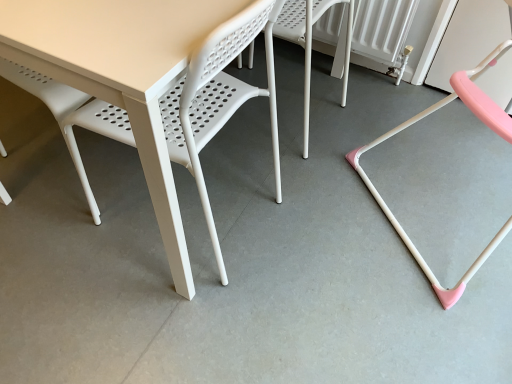
What are the coordinates of `white plastic chair at center, the 1th chair when ordered from left to right` in the screenshot? It's located at (309, 40).

In order to face white plastic chair at center, the second chair viewed from the right, should I rotate leftwards or rightwards?

Turn right by 5.564 degrees to look at white plastic chair at center, the second chair viewed from the right.

Image resolution: width=512 pixels, height=384 pixels. I want to click on pink plastic chair at right, which is counted as the second chair, starting from the left, so click(x=419, y=120).

The image size is (512, 384). What do you see at coordinates (150, 84) in the screenshot?
I see `white plastic table at center` at bounding box center [150, 84].

Identify the location of white plastic chair at center, the 1th chair when ordered from left to right. (309, 40).

How distant is white plastic chair at center, the second chair viewed from the right, from pink plastic chair at right, which is counted as the second chair, starting from the left?

white plastic chair at center, the second chair viewed from the right, is 19.30 inches from pink plastic chair at right, which is counted as the second chair, starting from the left.

Which object is thinner, white plastic chair at center, the 1th chair when ordered from left to right, or pink plastic chair at right, which is counted as the second chair, starting from the left?

Thinner between the two is white plastic chair at center, the 1th chair when ordered from left to right.

From a real-world perspective, relative to pink plastic chair at right, the first chair when ordered from right to left, is white plastic chair at center, the second chair viewed from the right, vertically above or below?

white plastic chair at center, the second chair viewed from the right, is situated lower than pink plastic chair at right, the first chair when ordered from right to left, in the real world.

From the image's perspective, is white plastic chair at center, the 1th chair when ordered from left to right, over pink plastic chair at right, the first chair when ordered from right to left?

Correct, white plastic chair at center, the 1th chair when ordered from left to right, appears higher than pink plastic chair at right, the first chair when ordered from right to left, in the image.

You are a GUI agent. You are given a task and a screenshot of the screen. Output one action in this format:
    pyautogui.click(x=<x>, y=<y>)
    Task: Click on the 1st chair behind the white plastic table at center, starting your count from the anchor
    The image size is (512, 384).
    Given the screenshot: What is the action you would take?
    pyautogui.click(x=419, y=120)

Can you confirm if pink plastic chair at right, the first chair when ordered from right to left, is positioned to the left of white plastic table at center?

In fact, pink plastic chair at right, the first chair when ordered from right to left, is to the right of white plastic table at center.

Which point is more forward, (368, 180) or (112, 35)?

Point (112, 35)

Is pink plastic chair at right, the first chair when ordered from right to left, inside the boundaries of white plastic table at center, or outside?

pink plastic chair at right, the first chair when ordered from right to left, is not enclosed by white plastic table at center.

At what (x,y) coordinates should I click in order to perform the action: click on table on the left of the pink plastic chair at right, the first chair when ordered from right to left. Please return your answer as a coordinate pair (x, y). The width and height of the screenshot is (512, 384). Looking at the image, I should click on (150, 84).

Is white plastic table at center inside or outside of pink plastic chair at right, which is counted as the second chair, starting from the left?

white plastic table at center is not inside pink plastic chair at right, which is counted as the second chair, starting from the left, it's outside.

What's the angular difference between white plastic table at center and pink plastic chair at right, which is counted as the second chair, starting from the left,'s facing directions?

48.1 degrees separate the facing orientations of white plastic table at center and pink plastic chair at right, which is counted as the second chair, starting from the left.

How far apart are white plastic table at center and pink plastic chair at right, the first chair when ordered from right to left?

white plastic table at center and pink plastic chair at right, the first chair when ordered from right to left, are 32.81 inches apart from each other.

From the image's perspective, between white plastic table at center and white plastic chair at center, the second chair viewed from the right, who is located below?

white plastic table at center.

Is white plastic table at center thinner than white plastic chair at center, the 1th chair when ordered from left to right?

In fact, white plastic table at center might be wider than white plastic chair at center, the 1th chair when ordered from left to right.

Can you see white plastic table at center touching white plastic chair at center, the second chair viewed from the right?

white plastic table at center and white plastic chair at center, the second chair viewed from the right, are not in contact.

Based on the photo, is white plastic table at center aimed at white plastic chair at center, the second chair viewed from the right?

No.

Can you confirm if white plastic chair at center, the second chair viewed from the right, is thinner than white plastic table at center?

Yes.

Does white plastic chair at center, the 1th chair when ordered from left to right, lie behind white plastic table at center?

Yes, white plastic chair at center, the 1th chair when ordered from left to right, is further from the viewer.

Does point (307, 23) come closer to viewer compared to point (225, 35)?

That is False.

Is there a large distance between white plastic chair at center, the 1th chair when ordered from left to right, and white plastic table at center?

They are positioned close to each other.

Is pink plastic chair at right, which is counted as the second chair, starting from the left, in front of or behind white plastic chair at center, the 1th chair when ordered from left to right, in the image?

Clearly, pink plastic chair at right, which is counted as the second chair, starting from the left, is in front of white plastic chair at center, the 1th chair when ordered from left to right.

Is pink plastic chair at right, which is counted as the second chair, starting from the left, thinner than white plastic chair at center, the 1th chair when ordered from left to right?

No.

Does pink plastic chair at right, the first chair when ordered from right to left, appear on the left side of white plastic chair at center, the second chair viewed from the right?

No.

Which point is more forward, (469, 268) or (309, 109)?

The point (469, 268) is more forward.

Where is `chair above the white plastic chair at center, the 1th chair when ordered from left to right (from a real-world perspective)`? chair above the white plastic chair at center, the 1th chair when ordered from left to right (from a real-world perspective) is located at coordinates (419, 120).

This screenshot has width=512, height=384. In order to click on chair that is the 1st object located above the white plastic table at center (from the image's perspective) in this screenshot , I will do `click(419, 120)`.

In the scene shown: Based on their spatial positions, is white plastic chair at center, the second chair viewed from the right, or white plastic table at center closer to pink plastic chair at right, which is counted as the second chair, starting from the left?

white plastic chair at center, the second chair viewed from the right, is positioned closer to the anchor pink plastic chair at right, which is counted as the second chair, starting from the left.

When comparing their distances from white plastic table at center, does white plastic chair at center, the 1th chair when ordered from left to right, or pink plastic chair at right, which is counted as the second chair, starting from the left, seem closer?

white plastic chair at center, the 1th chair when ordered from left to right, is positioned closer to the anchor white plastic table at center.

Consider the image. Considering their positions, is white plastic table at center positioned further to white plastic chair at center, the 1th chair when ordered from left to right, than pink plastic chair at right, which is counted as the second chair, starting from the left?

white plastic table at center is further to white plastic chair at center, the 1th chair when ordered from left to right.

Looking at the image, which one is located closer to white plastic table at center, pink plastic chair at right, which is counted as the second chair, starting from the left, or white plastic chair at center, the second chair viewed from the right?

white plastic chair at center, the second chair viewed from the right, lies closer to white plastic table at center than the other object.

Based on their spatial positions, is white plastic table at center or white plastic chair at center, the second chair viewed from the right, further from pink plastic chair at right, the first chair when ordered from right to left?

white plastic table at center is positioned further to the anchor pink plastic chair at right, the first chair when ordered from right to left.

When comparing their distances from white plastic chair at center, the 1th chair when ordered from left to right, does pink plastic chair at right, the first chair when ordered from right to left, or white plastic table at center seem further?

white plastic table at center is positioned further to the anchor white plastic chair at center, the 1th chair when ordered from left to right.

This screenshot has height=384, width=512. I want to click on chair between white plastic table at center and pink plastic chair at right, which is counted as the second chair, starting from the left, in the horizontal direction, so click(x=309, y=40).